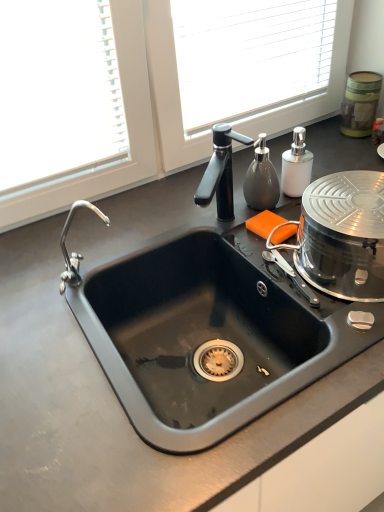
Identify the location of vacant area situated to the left side of white matte soap dispenser at upper right. The height and width of the screenshot is (512, 384). (244, 204).